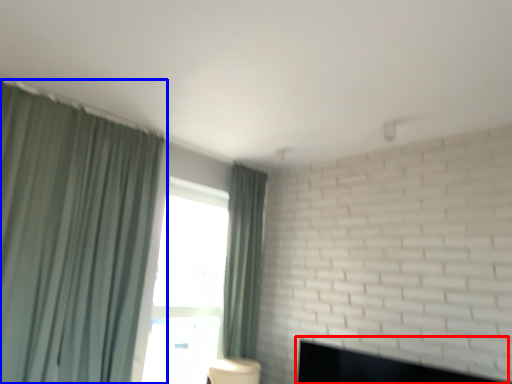
Question: Among these objects, which one is nearest to the camera, fireplace (highlighted by a red box) or curtain (highlighted by a blue box)?

Choices:
 (A) fireplace
 (B) curtain

Answer: (A)